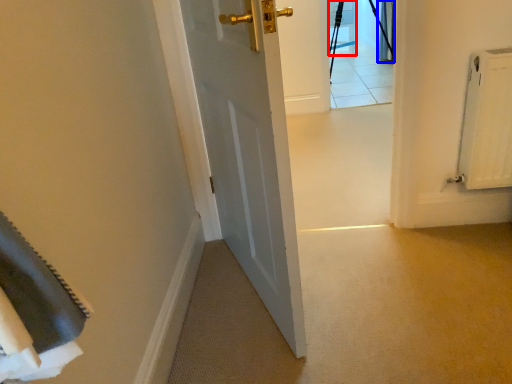
Question: Which object appears closest to the camera in this image, chair (highlighted by a red box) or curtain (highlighted by a blue box)?

Choices:
 (A) chair
 (B) curtain

Answer: (B)